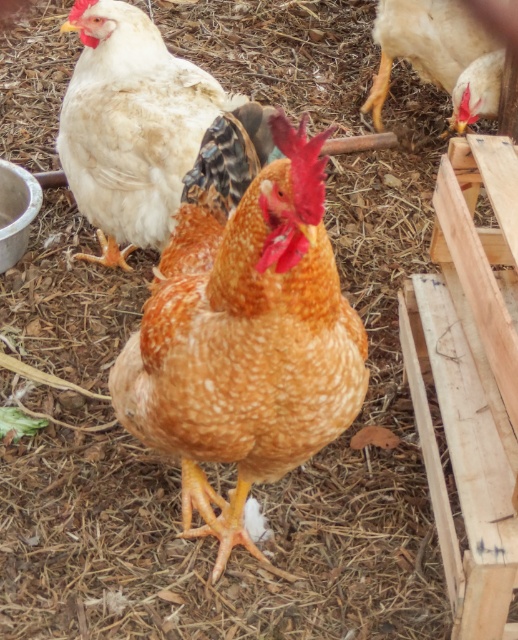
Question: Is speckled feathered chicken at center behind matte white chicken at upper right?

Choices:
 (A) yes
 (B) no

Answer: (B)

Question: Where is speckled feathered chicken at center located in relation to white fluffy chicken at upper left in the image?

Choices:
 (A) below
 (B) above

Answer: (A)

Question: Which point appears farthest from the camera in this image?

Choices:
 (A) (194, 310)
 (B) (93, 93)

Answer: (B)

Question: Which object appears closest to the camera in this image?

Choices:
 (A) matte white chicken at upper right
 (B) speckled feathered chicken at center

Answer: (B)

Question: Which of the following is the farthest from the observer?

Choices:
 (A) speckled feathered chicken at center
 (B) matte white chicken at upper right

Answer: (B)

Question: Observing the image, what is the correct spatial positioning of speckled feathered chicken at center in reference to matte white chicken at upper right?

Choices:
 (A) right
 (B) left

Answer: (B)